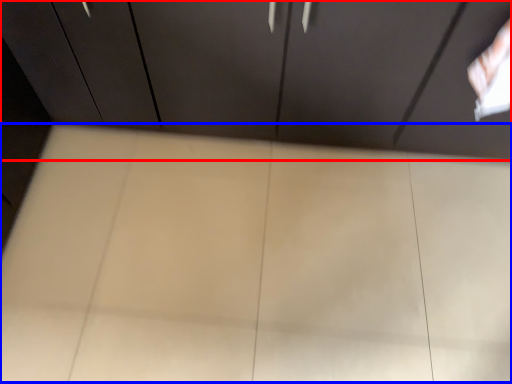
Question: Which object is further to the camera taking this photo, cupboard (highlighted by a red box) or plywood (highlighted by a blue box)?

Choices:
 (A) cupboard
 (B) plywood

Answer: (B)